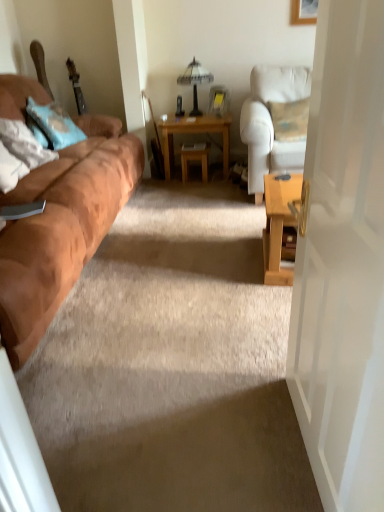
I want to click on white fabric chair at right, so [x=271, y=122].

In order to face light brown wooden table at center, should I rotate leftwards or rightwards?

To align with it, rotate right about 0.889°.

Image resolution: width=384 pixels, height=512 pixels. Describe the element at coordinates (195, 158) in the screenshot. I see `wooden stool at center` at that location.

What do you see at coordinates (62, 228) in the screenshot?
I see `suede brown couch at left` at bounding box center [62, 228].

What is the approximate width of white glass table lamp at upper center?

31.14 centimeters.

This screenshot has height=512, width=384. I want to click on white glossy door at right, so click(343, 262).

From the image's perspective, is light brown wooden table at center above or below wooden stool at center?

light brown wooden table at center is situated higher than wooden stool at center in the image.

Considering the relative positions of light brown wooden table at center and wooden stool at center in the image provided, is light brown wooden table at center to the right of wooden stool at center from the viewer's perspective?

Yes, light brown wooden table at center is to the right of wooden stool at center.

Is light brown wooden table at center thinner than wooden stool at center?

No, light brown wooden table at center is not thinner than wooden stool at center.

Relative to wooden stool at center, is light brown wooden table at center in front or behind?

Visually, light brown wooden table at center is located in front of wooden stool at center.

Is suede brown couch at left completely or partially inside white glossy door at right?

Actually, suede brown couch at left is outside white glossy door at right.

Between white glossy door at right and suede brown couch at left, which one has more height?

Standing taller between the two is white glossy door at right.

Is white glossy door at right directly adjacent to suede brown couch at left?

No, white glossy door at right is not beside suede brown couch at left.

Is suede brown couch at left at the back of white glossy door at right?

No, white glossy door at right is not facing away from suede brown couch at left.

Is wooden stool at center far from wooden picture frame at upper right?

Yes, wooden stool at center and wooden picture frame at upper right are located far from each other.

In the scene shown: From the image's perspective, is wooden stool at center above or below wooden picture frame at upper right?

wooden stool at center is situated lower than wooden picture frame at upper right in the image.

Which object is thinner, wooden stool at center or wooden picture frame at upper right?

wooden picture frame at upper right is thinner.

Choose the correct answer: Is white glossy door at right inside soft white pillow at left, which is the 2th pillow from back to front, or outside it?

white glossy door at right is outside soft white pillow at left, which is the 2th pillow from back to front.

Identify the location of the 1st pillow positioned above the white glossy door at right (from the image's perspective). The width and height of the screenshot is (384, 512). (24, 144).

Can you confirm if white glossy door at right is smaller than soft white pillow at left, which is the 2th pillow from back to front?

No, white glossy door at right is not smaller than soft white pillow at left, which is the 2th pillow from back to front.

Is white glossy door at right closer to camera compared to soft white pillow at left, which ranks as the 1th pillow in front-to-back order?

That is True.

From a real-world perspective, is wooden picture frame at upper right physically located above or below suede brown couch at left?

wooden picture frame at upper right is situated higher than suede brown couch at left in the real world.

Would you say suede brown couch at left is part of wooden picture frame at upper right's contents?

No.

Between point (377, 90) and point (182, 148), which one is positioned in front?

The point (377, 90) is closer to the camera.

Can you confirm if white glossy door at right is taller than wooden stool at center?

Yes, white glossy door at right is taller than wooden stool at center.

Between white glossy door at right and wooden stool at center, which one has larger width?

wooden stool at center.

Is white glossy door at right further to camera compared to wooden stool at center?

No, white glossy door at right is in front of wooden stool at center.

Could you tell me if light blue fabric pillow at left, the first pillow positioned from the back, is facing wooden picture frame at upper right?

No, light blue fabric pillow at left, the first pillow positioned from the back, is not aimed at wooden picture frame at upper right.

From their relative heights in the image, would you say light blue fabric pillow at left, the second pillow in the front-to-back sequence, is taller or shorter than wooden picture frame at upper right?

Clearly, light blue fabric pillow at left, the second pillow in the front-to-back sequence, is taller compared to wooden picture frame at upper right.

Is light blue fabric pillow at left, the second pillow in the front-to-back sequence, touching wooden picture frame at upper right?

No, light blue fabric pillow at left, the second pillow in the front-to-back sequence, is not next to wooden picture frame at upper right.

From a real-world perspective, is light blue fabric pillow at left, the second pillow in the front-to-back sequence, located beneath wooden picture frame at upper right?

Yes, from a real-world perspective, light blue fabric pillow at left, the second pillow in the front-to-back sequence, is beneath wooden picture frame at upper right.

You are a GUI agent. You are given a task and a screenshot of the screen. Output one action in this format:
    pyautogui.click(x=<x>, y=<y>)
    Task: Click on the stool on the left of light brown wooden table at center
    The image size is (384, 512).
    Given the screenshot: What is the action you would take?
    [195, 158]

This screenshot has height=512, width=384. I want to click on door on the right of suede brown couch at left, so click(343, 262).

From the picture: Looking at the image, which one is located closer to suede brown couch at left, white glass table lamp at upper center or light brown wooden table at center?

The object closer to suede brown couch at left is light brown wooden table at center.

From the image, which object appears to be nearer to white glass table lamp at upper center, suede brown couch at left or wooden picture frame at upper right?

wooden picture frame at upper right is closer to white glass table lamp at upper center.

Based on the photo, considering their positions, is suede brown couch at left positioned closer to wooden stool at center than white glass table lamp at upper center?

The object closer to wooden stool at center is white glass table lamp at upper center.

Estimate the real-world distances between objects in this image. Which object is closer to white fabric chair at right, wooden stool at center or light brown wooden table at center?

light brown wooden table at center lies closer to white fabric chair at right than the other object.

Estimate the real-world distances between objects in this image. Which object is closer to soft white pillow at left, which ranks as the 1th pillow in front-to-back order, white glossy door at right or light blue fabric pillow at left, the second pillow in the front-to-back sequence?

light blue fabric pillow at left, the second pillow in the front-to-back sequence, is positioned closer to the anchor soft white pillow at left, which ranks as the 1th pillow in front-to-back order.

From the image, which object appears to be nearer to light blue fabric pillow at left, the second pillow in the front-to-back sequence, light brown wooden table at center or suede brown couch at left?

suede brown couch at left lies closer to light blue fabric pillow at left, the second pillow in the front-to-back sequence, than the other object.

Based on their spatial positions, is white glass table lamp at upper center or suede brown couch at left further from white fabric chair at right?

The object further to white fabric chair at right is suede brown couch at left.

Which object lies further to the anchor point wooden picture frame at upper right, white fabric chair at right or suede brown couch at left?

suede brown couch at left is positioned further to the anchor wooden picture frame at upper right.

The image size is (384, 512). In order to click on table lamp situated between light blue fabric pillow at left, the second pillow in the front-to-back sequence, and white fabric chair at right from left to right in this screenshot , I will do `click(195, 82)`.

I want to click on pillow between soft white pillow at left, which is the 2th pillow from back to front, and wooden stool at center, along the z-axis, so click(x=53, y=125).

Where is `table lamp between white fabric chair at right and light brown wooden table at center from front to back`? table lamp between white fabric chair at right and light brown wooden table at center from front to back is located at coordinates (195, 82).

Locate an element on the screen. The height and width of the screenshot is (512, 384). picture frame between suede brown couch at left and white glass table lamp at upper center in the front-back direction is located at coordinates (304, 12).